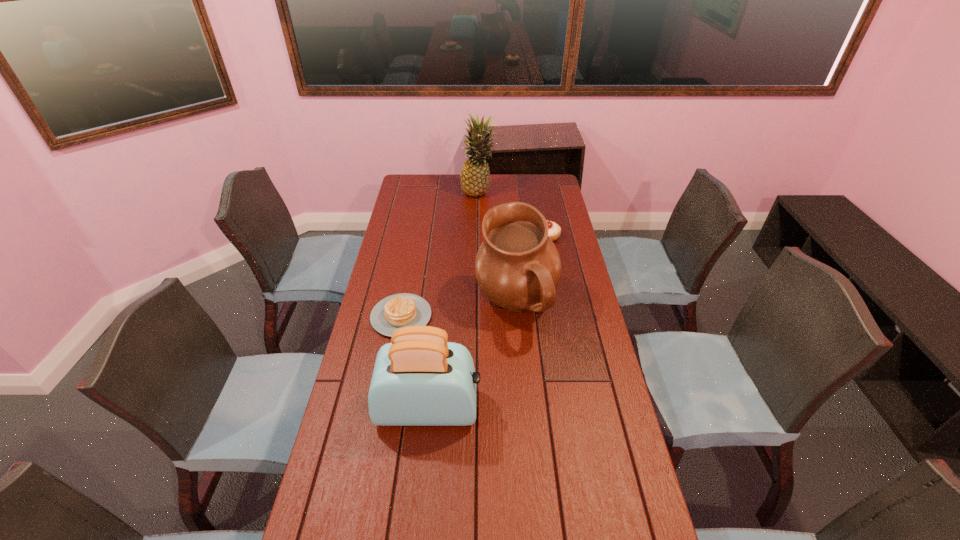
Identify the location of pineapple. (475, 175).

Where is `cream pitcher`? This screenshot has height=540, width=960. cream pitcher is located at coordinates coord(517,267).

Locate an element on the screen. the nearest object is located at coordinates [419, 379].

Where is `pastry`? This screenshot has height=540, width=960. pastry is located at coordinates (554, 232).

Locate an element on the screen. The image size is (960, 540). the second farthest object is located at coordinates (554, 232).

The image size is (960, 540). Identify the location of the shortest object. (396, 311).

This screenshot has width=960, height=540. What are the coordinates of `free location located 0.320m on the right of the pineapple` in the screenshot? It's located at (562, 194).

Where is `vacant area situated at the spout of the cream pitcher`? vacant area situated at the spout of the cream pitcher is located at coordinates (439, 306).

I want to click on vacant space located 0.300m at the spout of the cream pitcher, so click(393, 306).

Identify the location of vacant region located 0.360m at the spout of the cream pitcher. (375, 306).